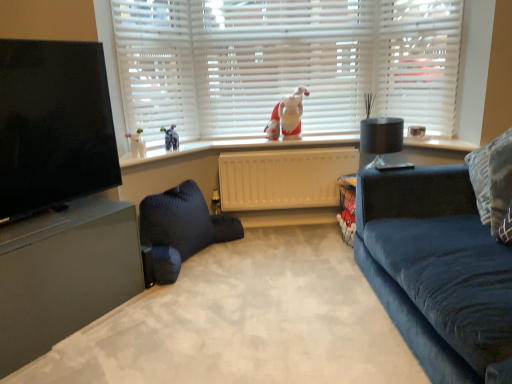
Question: From the image's perspective, is black matte lamp at right located above matte black tv at left?

Choices:
 (A) no
 (B) yes

Answer: (A)

Question: From the image's perspective, would you say black matte lamp at right is shown under matte black tv at left?

Choices:
 (A) no
 (B) yes

Answer: (B)

Question: Is matte black tv at left a part of black matte lamp at right?

Choices:
 (A) no
 (B) yes

Answer: (A)

Question: Would you say black matte lamp at right is a long distance from matte black tv at left?

Choices:
 (A) yes
 (B) no

Answer: (A)

Question: Is black matte lamp at right positioned before matte black tv at left?

Choices:
 (A) yes
 (B) no

Answer: (B)

Question: From a real-world perspective, is black matte lamp at right under matte black tv at left?

Choices:
 (A) yes
 (B) no

Answer: (A)

Question: Is white matte blinds at center further to camera compared to velvet blue couch at right?

Choices:
 (A) no
 (B) yes

Answer: (B)

Question: Considering the relative sizes of white matte blinds at center and velvet blue couch at right in the image provided, is white matte blinds at center bigger than velvet blue couch at right?

Choices:
 (A) yes
 (B) no

Answer: (B)

Question: Is white matte blinds at center to the left of velvet blue couch at right from the viewer's perspective?

Choices:
 (A) yes
 (B) no

Answer: (A)

Question: Would you say white matte blinds at center is outside velvet blue couch at right?

Choices:
 (A) yes
 (B) no

Answer: (A)

Question: Does white matte blinds at center have a lesser width compared to velvet blue couch at right?

Choices:
 (A) yes
 (B) no

Answer: (A)

Question: Is velvet blue couch at right surrounded by white matte blinds at center?

Choices:
 (A) yes
 (B) no

Answer: (B)

Question: Does dark blue knitted bean bag at center have a lesser width compared to white plastic window frame at upper right?

Choices:
 (A) no
 (B) yes

Answer: (A)